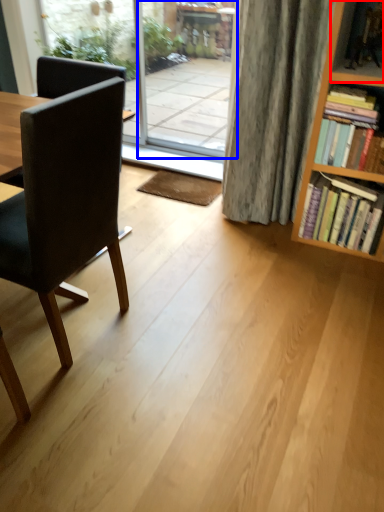
Question: Which object is closer to the camera taking this photo, shelf (highlighted by a red box) or screen door (highlighted by a blue box)?

Choices:
 (A) shelf
 (B) screen door

Answer: (A)